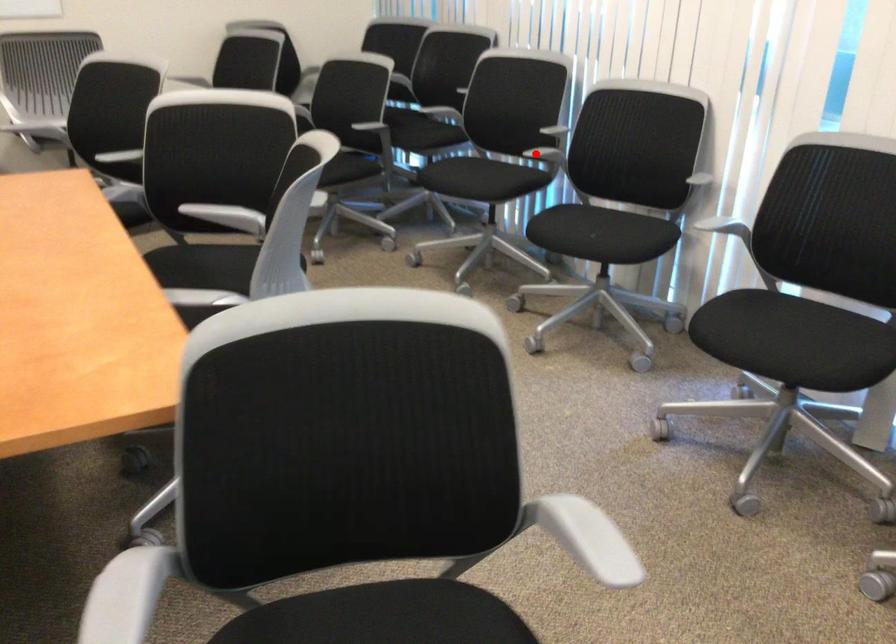
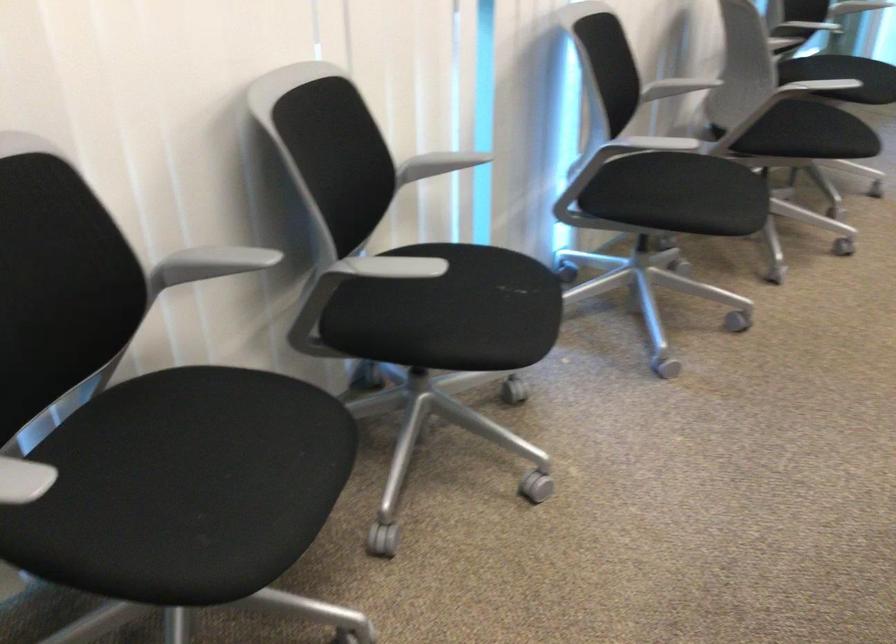
Question: A red point is marked in image1. In image2, is the corresponding 3D point closer to the camera or farther? Reply with the corresponding letter.

Choices:
 (A) The corresponding 3D point is closer.
 (B) The corresponding 3D point is farther.

Answer: (A)